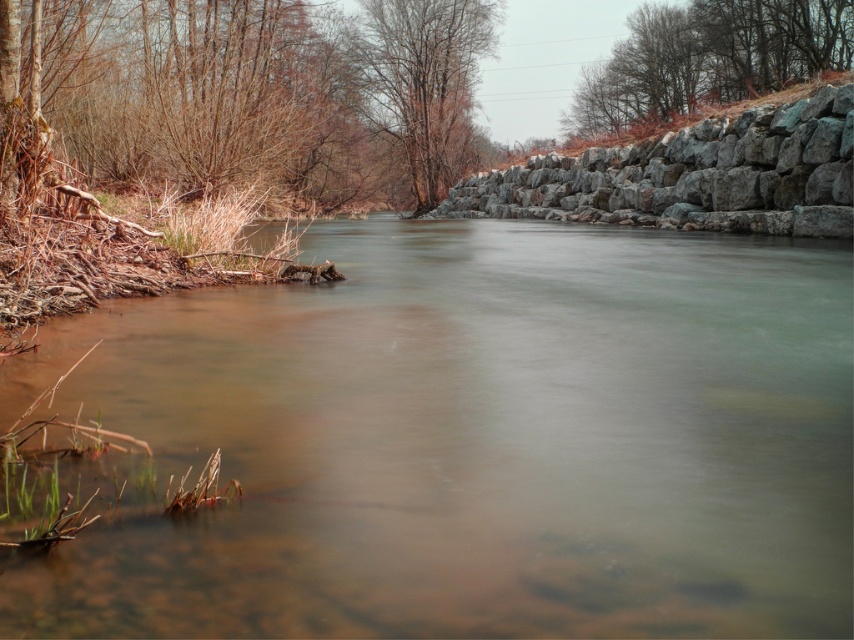
Question: Can you confirm if gray rock wall at right is wider than bare wood tree at upper center?

Choices:
 (A) yes
 (B) no

Answer: (B)

Question: Which point is closer to the camera taking this photo?

Choices:
 (A) (623, 198)
 (B) (598, 90)

Answer: (A)

Question: Which of the following is the farthest from the observer?

Choices:
 (A) (592, 198)
 (B) (447, 88)
 (C) (145, 412)

Answer: (B)

Question: Considering the relative positions of clear water at center and gray rock wall at right in the image provided, where is clear water at center located with respect to gray rock wall at right?

Choices:
 (A) above
 (B) below

Answer: (B)

Question: Which point appears farthest from the camera in this image?

Choices:
 (A) (761, 388)
 (B) (433, 51)
 (C) (662, 45)

Answer: (B)

Question: Is brown textured rock at upper right smaller than bare wood tree at upper center?

Choices:
 (A) yes
 (B) no

Answer: (B)